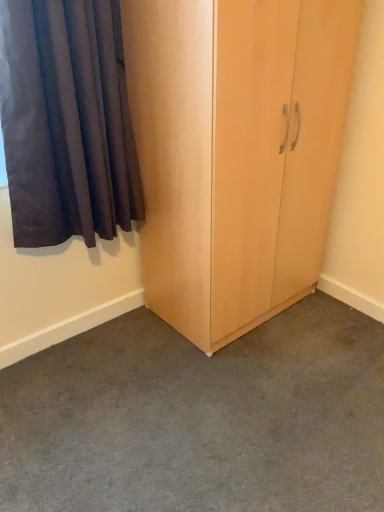
You are a GUI agent. You are given a task and a screenshot of the screen. Output one action in this format:
    pyautogui.click(x=<x>, y=<y>)
    Task: Click on the vacant location below dark blue fabric curtain at left (from a real-world perspective)
    This screenshot has width=384, height=512.
    Given the screenshot: What is the action you would take?
    pyautogui.click(x=98, y=334)